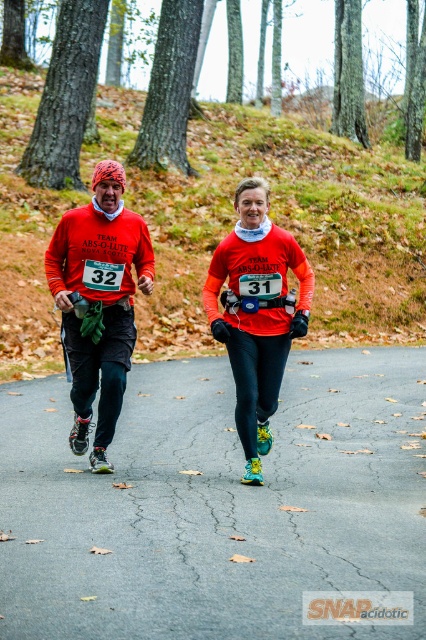
Question: Considering the relative positions of green mossy hillside at upper center and matte orange long-sleeve shirt at center in the image provided, where is green mossy hillside at upper center located with respect to matte orange long-sleeve shirt at center?

Choices:
 (A) below
 (B) above

Answer: (B)

Question: Which of the following is the farthest from the observer?

Choices:
 (A) (143, 275)
 (B) (279, 208)
 (C) (298, 260)
 (D) (356, 436)

Answer: (B)

Question: Is green mossy hillside at upper center further to camera compared to matte orange long-sleeve shirt at center?

Choices:
 (A) no
 (B) yes

Answer: (B)

Question: Does matte red running shirt at center appear on the right side of matte orange long-sleeve shirt at center?

Choices:
 (A) no
 (B) yes

Answer: (A)

Question: Which object is closer to the camera taking this photo?

Choices:
 (A) matte red shirt at center
 (B) green mossy hillside at upper center

Answer: (A)

Question: Which point is farther to the camera?

Choices:
 (A) (121, 506)
 (B) (124, 173)

Answer: (B)